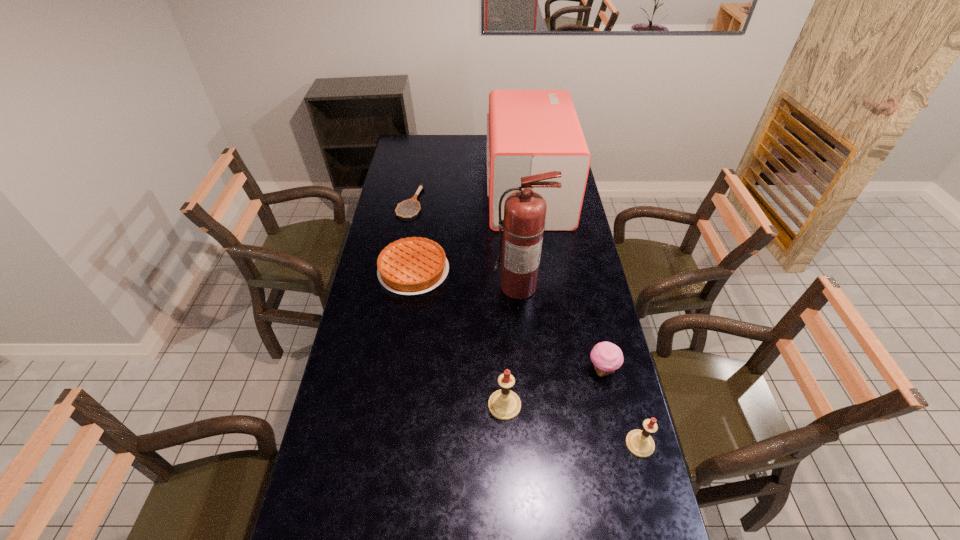
Find the location of a particular element. Image resolution: width=960 pixels, height=540 pixels. free space located 0.190m on the front of the second nearest object is located at coordinates (508, 487).

Locate an element on the screen. The width and height of the screenshot is (960, 540). vacant space located on the front of the fourth tallest object is located at coordinates (648, 476).

Where is `vacant region located on the front-facing side of the fire extinguisher`? vacant region located on the front-facing side of the fire extinguisher is located at coordinates (522, 324).

Identify the location of vacant space located 0.050m on the surface of the sixth shortest object where the text is embossed. The image size is (960, 540). (476, 193).

Identify the location of vacant region located on the surface of the sixth shortest object where the text is embossed. Image resolution: width=960 pixels, height=540 pixels. (474, 193).

Where is `free region located on the surface of the sixth shortest object where the text is embossed`? Image resolution: width=960 pixels, height=540 pixels. free region located on the surface of the sixth shortest object where the text is embossed is located at coordinates (462, 193).

Identify the location of free spot located 0.060m on the front of the sixth tallest object. (408, 310).

Image resolution: width=960 pixels, height=540 pixels. In order to click on blank space located on the back of the tennis racket in this screenshot , I will do `click(415, 177)`.

The image size is (960, 540). In order to click on blank area located on the back of the fifth tallest object in this screenshot , I will do `click(588, 306)`.

You are a GUI agent. You are given a task and a screenshot of the screen. Output one action in this format:
    pyautogui.click(x=<x>, y=<y>)
    Task: Click on the pie that is at the left edge
    Image resolution: width=960 pixels, height=540 pixels.
    Given the screenshot: What is the action you would take?
    pyautogui.click(x=414, y=265)